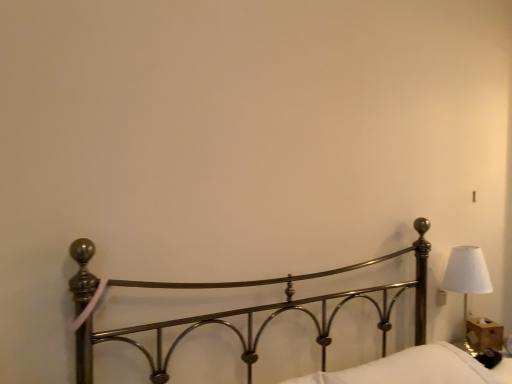
Question: Is white soft pillow at lower right in front of or behind white fabric lampshade at right in the image?

Choices:
 (A) behind
 (B) front

Answer: (B)

Question: From a real-world perspective, is white soft pillow at lower right above or below white fabric lampshade at right?

Choices:
 (A) below
 (B) above

Answer: (A)

Question: Which of these objects is positioned farthest from the polished metal bed at center?

Choices:
 (A) wooden tissue box at lower right
 (B) white fabric lampshade at right
 (C) white soft pillow at lower right

Answer: (A)

Question: Which is farther from the white fabric lampshade at right?

Choices:
 (A) polished metal bed at center
 (B) wooden tissue box at lower right
 (C) white soft pillow at lower right

Answer: (C)